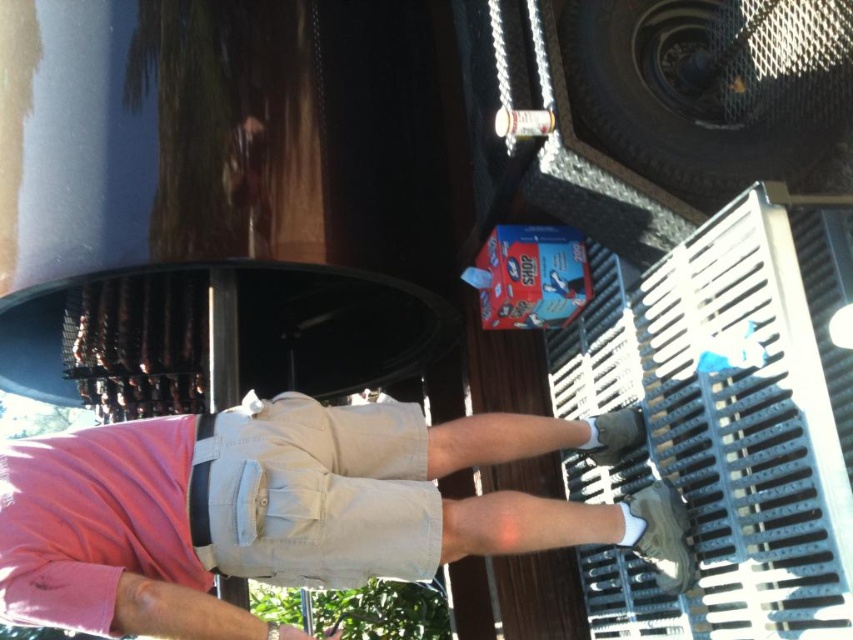
Is pink cotton shirt at upper left closer to camera compared to khaki cotton shorts at center?

Yes, pink cotton shirt at upper left is closer to the viewer.

Looking at this image, can you confirm if pink cotton shirt at upper left is positioned below khaki cotton shorts at center?

Yes, pink cotton shirt at upper left is below khaki cotton shorts at center.

Does point (219, 612) lie in front of point (196, 499)?

Yes, it is in front of point (196, 499).

The width and height of the screenshot is (853, 640). I want to click on pink cotton shirt at upper left, so click(x=289, y=508).